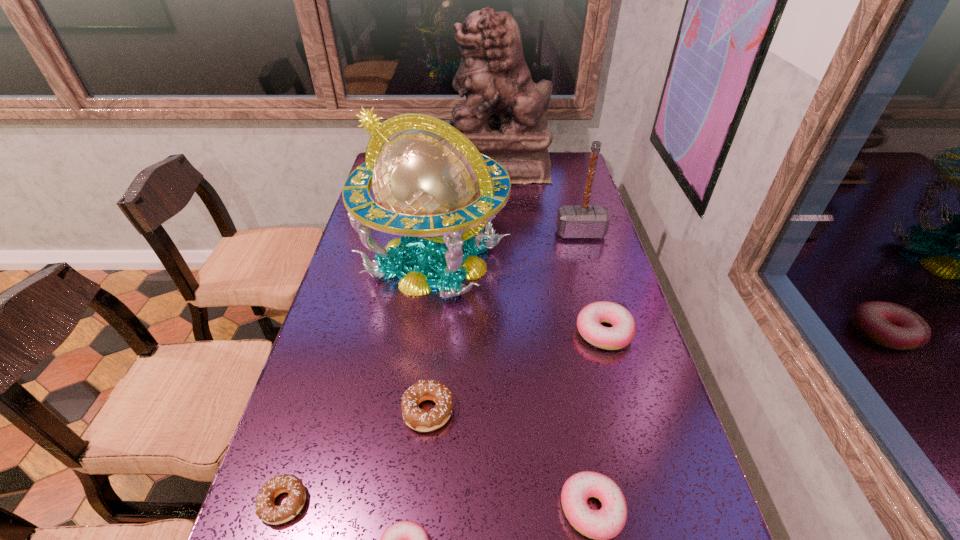
Where is `sculpture`? sculpture is located at coordinates (504, 115).

Image resolution: width=960 pixels, height=540 pixels. Identify the location of the farthest object. (504, 115).

Locate an element on the screen. globe is located at coordinates (431, 184).

At what (x,y) coordinates should I click in order to perform the action: click on the sixth shortest object. Please return your answer as a coordinate pair (x, y). Image resolution: width=960 pixels, height=540 pixels. Looking at the image, I should click on (573, 221).

Find the location of `hammer`. hammer is located at coordinates (573, 221).

Identify the location of the farthest doughnut. (589, 319).

What are the coordinates of `the farthest pink doughnut` in the screenshot? It's located at (589, 319).

Find the location of `the right chocolate doughnut`. the right chocolate doughnut is located at coordinates (418, 419).

The image size is (960, 540). I want to click on the farther chocolate doughnut, so click(x=418, y=419).

Locate an element on the screen. the leftmost doughnut is located at coordinates (265, 509).